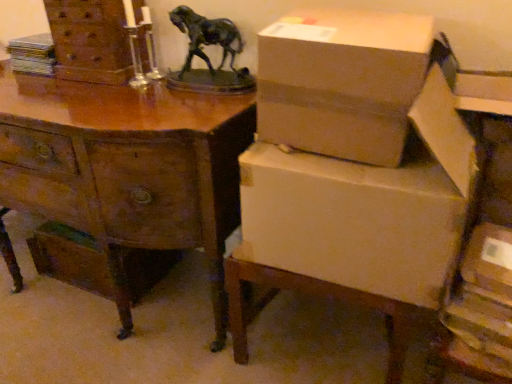
Question: Can you confirm if wooden desk at center is wider than wooden chest of drawers at upper left?

Choices:
 (A) no
 (B) yes

Answer: (B)

Question: Is wooden desk at center at the left side of wooden chest of drawers at upper left?

Choices:
 (A) no
 (B) yes

Answer: (B)

Question: Does wooden desk at center have a smaller size compared to wooden chest of drawers at upper left?

Choices:
 (A) yes
 (B) no

Answer: (B)

Question: Can you confirm if wooden desk at center is bigger than wooden chest of drawers at upper left?

Choices:
 (A) yes
 (B) no

Answer: (A)

Question: Does wooden desk at center have a lesser height compared to wooden chest of drawers at upper left?

Choices:
 (A) no
 (B) yes

Answer: (A)

Question: Considering the relative positions of cardboard box at upper right and white cardboard box at lower right in the image provided, is cardboard box at upper right to the left or to the right of white cardboard box at lower right?

Choices:
 (A) right
 (B) left

Answer: (B)

Question: From the image's perspective, is cardboard box at upper right above or below white cardboard box at lower right?

Choices:
 (A) below
 (B) above

Answer: (B)

Question: In the image, is cardboard box at upper right positioned in front of or behind white cardboard box at lower right?

Choices:
 (A) front
 (B) behind

Answer: (A)

Question: In terms of height, does cardboard box at upper right look taller or shorter compared to white cardboard box at lower right?

Choices:
 (A) tall
 (B) short

Answer: (A)

Question: Considering their positions, is wooden chest of drawers at upper left located in front of or behind white cardboard box at lower right?

Choices:
 (A) front
 (B) behind

Answer: (B)

Question: Looking at the image, does wooden chest of drawers at upper left seem bigger or smaller compared to white cardboard box at lower right?

Choices:
 (A) big
 (B) small

Answer: (B)

Question: In terms of width, does wooden chest of drawers at upper left look wider or thinner when compared to white cardboard box at lower right?

Choices:
 (A) thin
 (B) wide

Answer: (A)

Question: From a real-world perspective, is wooden chest of drawers at upper left physically located above or below white cardboard box at lower right?

Choices:
 (A) below
 (B) above

Answer: (B)

Question: In terms of width, does wooden chest of drawers at upper left look wider or thinner when compared to wooden desk at center?

Choices:
 (A) wide
 (B) thin

Answer: (B)

Question: Relative to wooden desk at center, is wooden chest of drawers at upper left in front or behind?

Choices:
 (A) behind
 (B) front

Answer: (A)